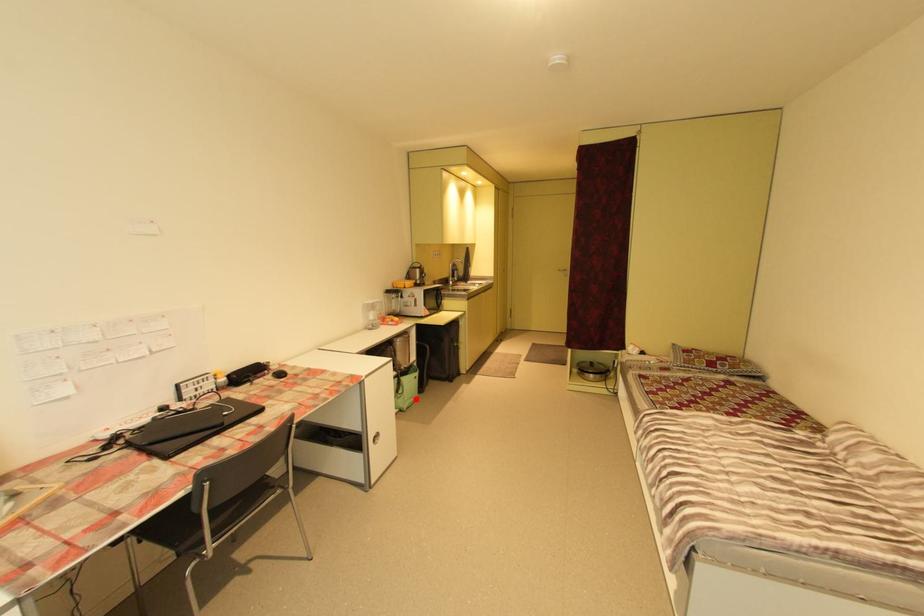
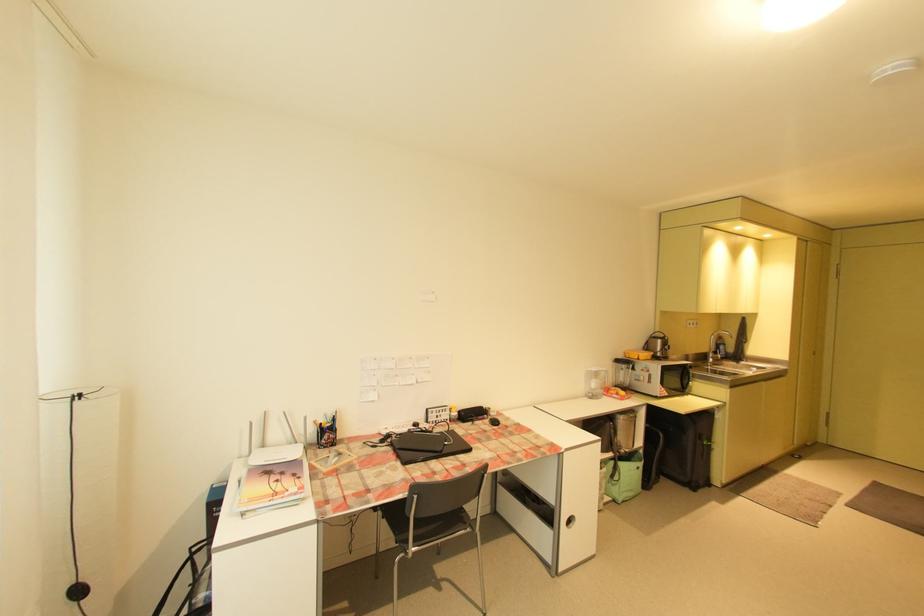
Where in the second image is the point corresponding to the highlighted location from the first image?

(634, 492)